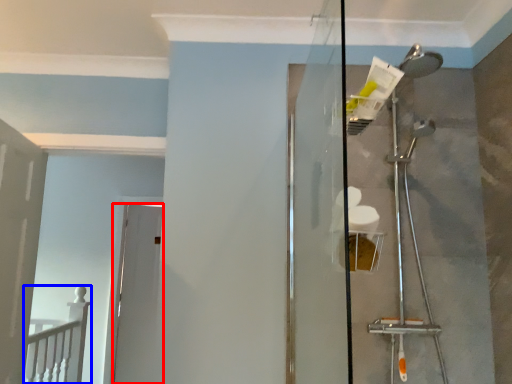
Question: Which object is closer to the camera taking this photo, door (highlighted by a red box) or rail (highlighted by a blue box)?

Choices:
 (A) door
 (B) rail

Answer: (B)